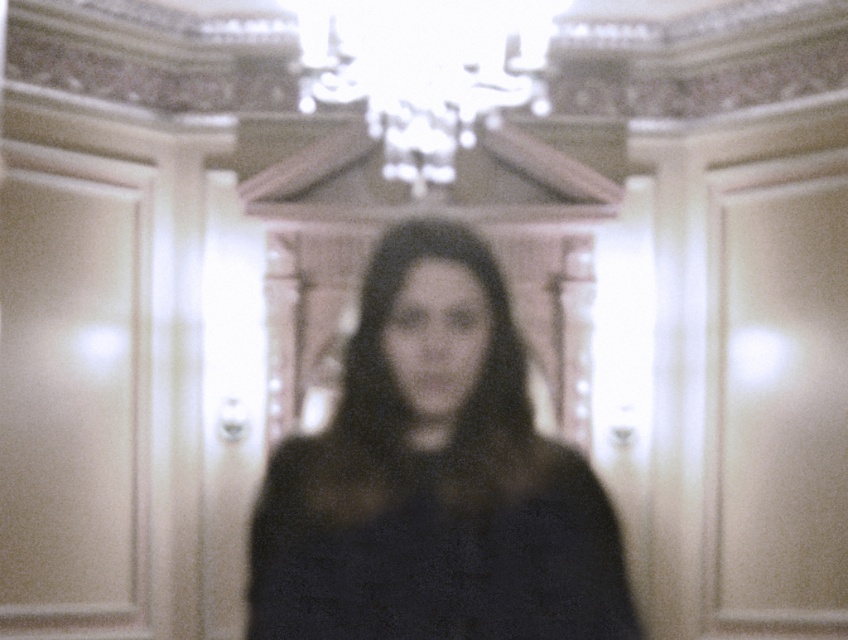
Question: Which of the following is the farthest from the observer?

Choices:
 (A) (293, 4)
 (B) (478, 346)

Answer: (A)

Question: Does black matte dress at center have a larger size compared to white glass chandelier at upper center?

Choices:
 (A) no
 (B) yes

Answer: (B)

Question: Is black matte dress at center wider than white glass chandelier at upper center?

Choices:
 (A) yes
 (B) no

Answer: (B)

Question: Among these points, which one is farthest from the camera?

Choices:
 (A) (503, 561)
 (B) (314, 60)

Answer: (B)

Question: Can you confirm if black matte dress at center is positioned above white glass chandelier at upper center?

Choices:
 (A) no
 (B) yes

Answer: (A)

Question: Which of the following is the farthest from the observer?

Choices:
 (A) white glass chandelier at upper center
 (B) black matte dress at center

Answer: (A)